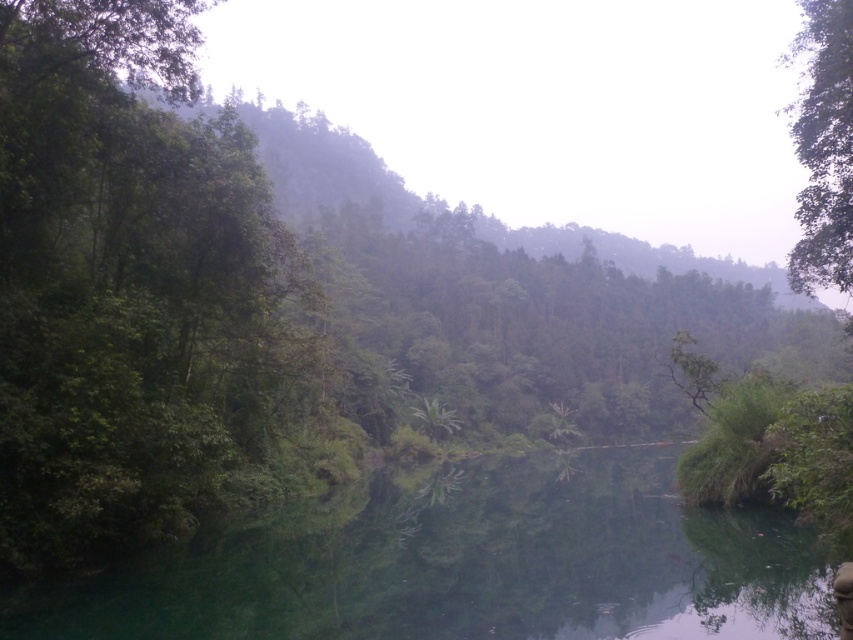
You are standing at the edge of the lake and see two points in the scene. The first point is at coordinates point (827, 611) and the second is at point (833, 266). Which point is closer to you?

Point (827, 611) is closer to the viewer than point (833, 266).

You are standing at the edge of the green glossy water at center and want to walk towards the green leafy tree at upper right. Which direction should you face to move towards it?

You should face towards the upper right direction to move towards the green leafy tree at upper right since it is located behind the green glossy water at center.

You are standing at the camera position in the serene natural landscape. There is a point marked at coordinates point (503, 598). Can you walk to this point without any obstacles? Please explain your reasoning.

The point (503, 598) is 53.18 feet away from the camera. Since the scene describes a calm river or lake with reflective surface and dense vegetation on the left, but the point is located in the foreground area which is likely clear of major obstacles, you can walk to this point without any significant obstacles in the way.